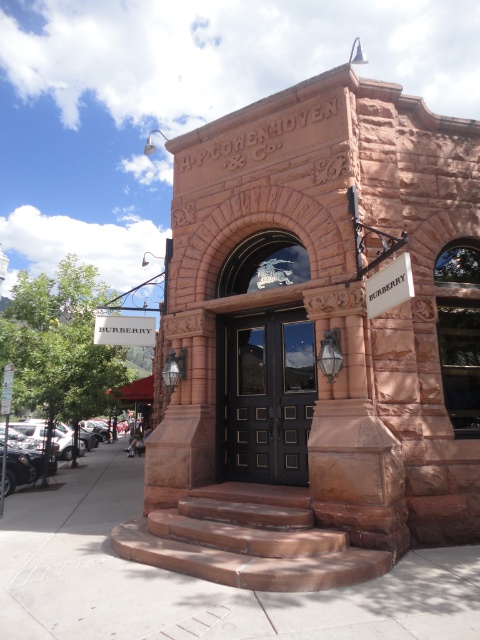
Can you confirm if brown stone stairs at center is shorter than white plastic street sign at lower left?

No.

Between point (227, 508) and point (10, 372), which one is positioned in front?

Point (227, 508)

What do you see at coordinates (249, 540) in the screenshot? Image resolution: width=480 pixels, height=640 pixels. I see `brown stone stairs at center` at bounding box center [249, 540].

At what (x,y) coordinates should I click in order to perform the action: click on brown stone stairs at center. Please return your answer as a coordinate pair (x, y). Looking at the image, I should click on [249, 540].

Does smooth concrete pavement at center appear over white plastic street sign at lower left?

No.

This screenshot has height=640, width=480. What do you see at coordinates (195, 579) in the screenshot? I see `smooth concrete pavement at center` at bounding box center [195, 579].

This screenshot has height=640, width=480. In order to click on smooth concrete pavement at center in this screenshot , I will do `click(195, 579)`.

Is brown stone stairs at center thinner than black polished wood door at center?

No, brown stone stairs at center is not thinner than black polished wood door at center.

Is point (259, 516) more distant than point (264, 388)?

No, (259, 516) is closer to viewer.

Is point (239, 557) positioned before point (300, 323)?

Yes, it is.

Where is `brown stone stairs at center`? The image size is (480, 640). brown stone stairs at center is located at coordinates (249, 540).